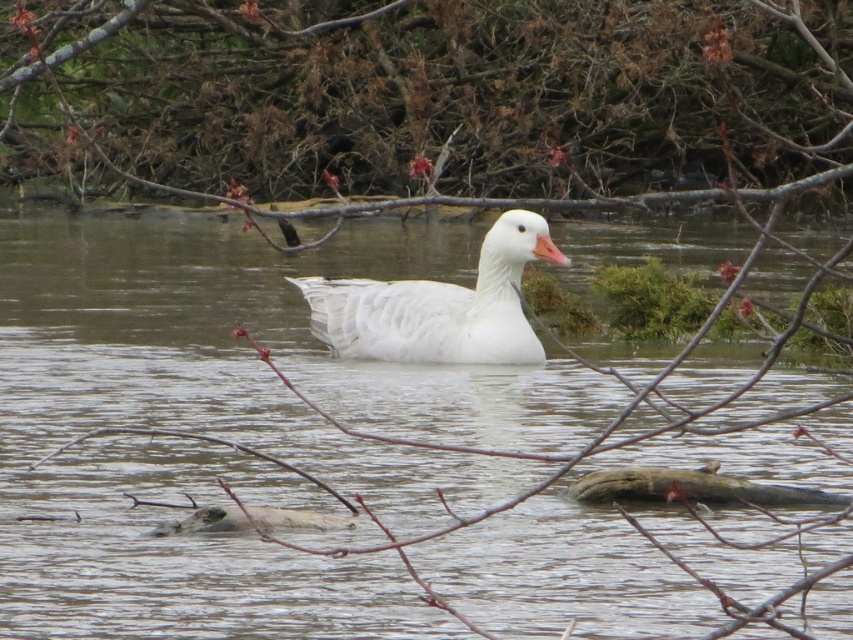
You are an observer looking at the scene. The clear water at center and the white matte duck at center are both visible. Which object is positioned closer to you?

The clear water at center is closer to the viewer than the white matte duck at center.

You are standing on the dock and want to throw a small pebble to hit the white matte duck at center. The pebble can travel 1.5 meters. Will it reach the clear water at center where the duck is swimming?

The clear water at center is 1.47 meters from the white matte duck at center, so the pebble can reach the clear water at center since 1.47 meters is within the pebble throw distance of 1.5 meters.